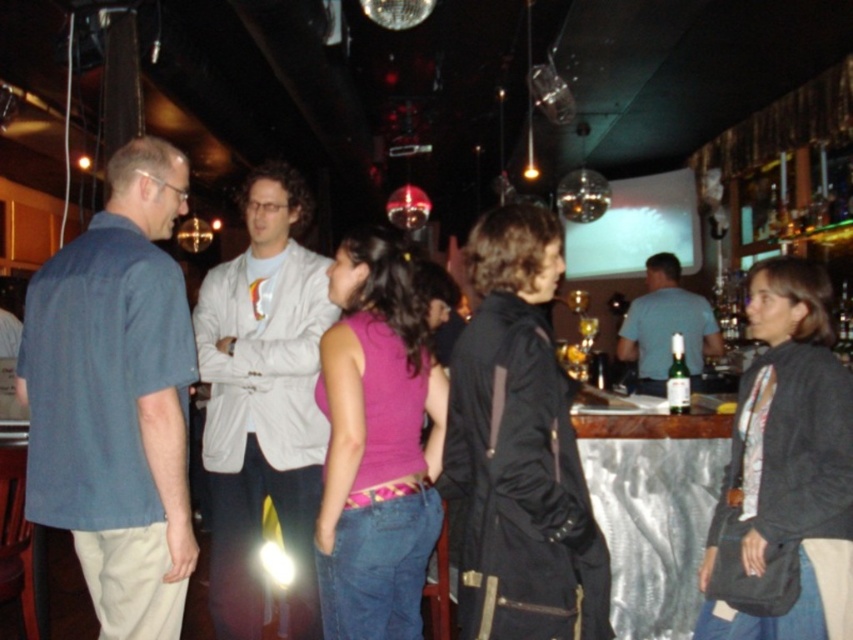
You are a bartender preparing a drink for a customer. You have a green glass bottle at bar and a purple matte tank top at center in your view. Which object should you pick up first if you need to grab the larger item?

The purple matte tank top at center is bigger than the green glass bottle at bar, so you should pick up the purple matte tank top at center first.

You are a photographer trying to capture a candid shot of the two people at the center of the bar scene. The subjects are wearing a matte black jacket at center and a purple matte tank top at center. Based on their positions, which clothing item is positioned higher in the frame?

The matte black jacket at center is positioned higher in the frame than the purple matte tank top at center, as it is described as being above it.

You are standing in the bar and want to move towards the two points marked in the image. Which point, point (606, 636) or point (822, 525), is closer to you?

Point (606, 636) is closer to the viewer than point (822, 525).